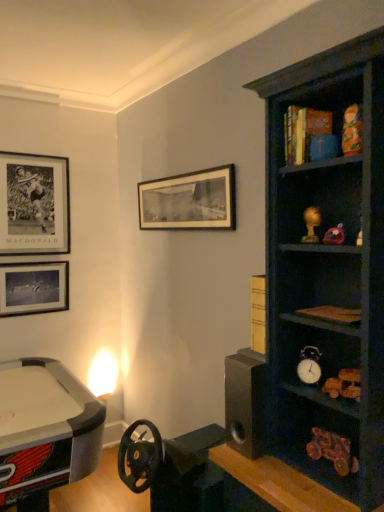
Question: From the image's perspective, is multicolored wooden doll at upper right, acting as the 2th toy starting from the bottom, located beneath matte gold figurine at upper right, the 2th toy from the top?

Choices:
 (A) no
 (B) yes

Answer: (A)

Question: From the image's perspective, is multicolored wooden doll at upper right, positioned as the 2th toy in back-to-front order, on top of matte gold figurine at upper right, acting as the 1th toy starting from the back?

Choices:
 (A) no
 (B) yes

Answer: (B)

Question: Is multicolored wooden doll at upper right, acting as the 2th toy starting from the bottom, shorter than matte gold figurine at upper right, placed as the 1th toy when sorted from bottom to top?

Choices:
 (A) yes
 (B) no

Answer: (B)

Question: Considering the relative sizes of multicolored wooden doll at upper right, positioned as the 2th toy in back-to-front order, and matte gold figurine at upper right, the 2th toy from the top, in the image provided, is multicolored wooden doll at upper right, positioned as the 2th toy in back-to-front order, taller than matte gold figurine at upper right, the 2th toy from the top,?

Choices:
 (A) no
 (B) yes

Answer: (B)

Question: Can you confirm if multicolored wooden doll at upper right, positioned as the 2th toy in back-to-front order, is wider than matte gold figurine at upper right, acting as the 1th toy starting from the back?

Choices:
 (A) yes
 (B) no

Answer: (B)

Question: Considering the positions of matte black picture frame at upper left, which is the first picture frame from left to right, and black matte picture frame at upper left, the 2th picture frame from the right, in the image, is matte black picture frame at upper left, which is the first picture frame from left to right, bigger or smaller than black matte picture frame at upper left, the 2th picture frame from the right,?

Choices:
 (A) small
 (B) big

Answer: (A)

Question: In terms of width, does matte black picture frame at upper left, which is the third picture frame from right to left, look wider or thinner when compared to black matte picture frame at upper left, the second picture frame in the left-to-right sequence?

Choices:
 (A) thin
 (B) wide

Answer: (B)

Question: Is matte black picture frame at upper left, which is the third picture frame from right to left, spatially inside black matte picture frame at upper left, the 2th picture frame from the right, or outside of it?

Choices:
 (A) outside
 (B) inside

Answer: (A)

Question: Considering the positions of matte black picture frame at upper left, which is the third picture frame from right to left, and black matte picture frame at upper left, the second picture frame in the left-to-right sequence, in the image, is matte black picture frame at upper left, which is the third picture frame from right to left, taller or shorter than black matte picture frame at upper left, the second picture frame in the left-to-right sequence,?

Choices:
 (A) tall
 (B) short

Answer: (B)

Question: Is black matte picture frame at upper center, which ranks as the first picture frame in right-to-left order, in front of or behind metallic silver alarm clock at center-right in the image?

Choices:
 (A) behind
 (B) front

Answer: (A)

Question: In terms of height, does black matte picture frame at upper center, positioned as the third picture frame in left-to-right order, look taller or shorter compared to metallic silver alarm clock at center-right?

Choices:
 (A) short
 (B) tall

Answer: (B)

Question: Is black matte picture frame at upper center, which ranks as the first picture frame in right-to-left order, wider or thinner than metallic silver alarm clock at center-right?

Choices:
 (A) wide
 (B) thin

Answer: (B)

Question: Is black matte picture frame at upper center, positioned as the third picture frame in left-to-right order, inside or outside of metallic silver alarm clock at center-right?

Choices:
 (A) inside
 (B) outside

Answer: (B)

Question: Is metallic silver alarm clock at center-right taller or shorter than matte black picture frame at upper left, which is the first picture frame from left to right?

Choices:
 (A) short
 (B) tall

Answer: (A)

Question: In the image, is metallic silver alarm clock at center-right on the left side or the right side of matte black picture frame at upper left, which is the first picture frame from left to right?

Choices:
 (A) right
 (B) left

Answer: (A)